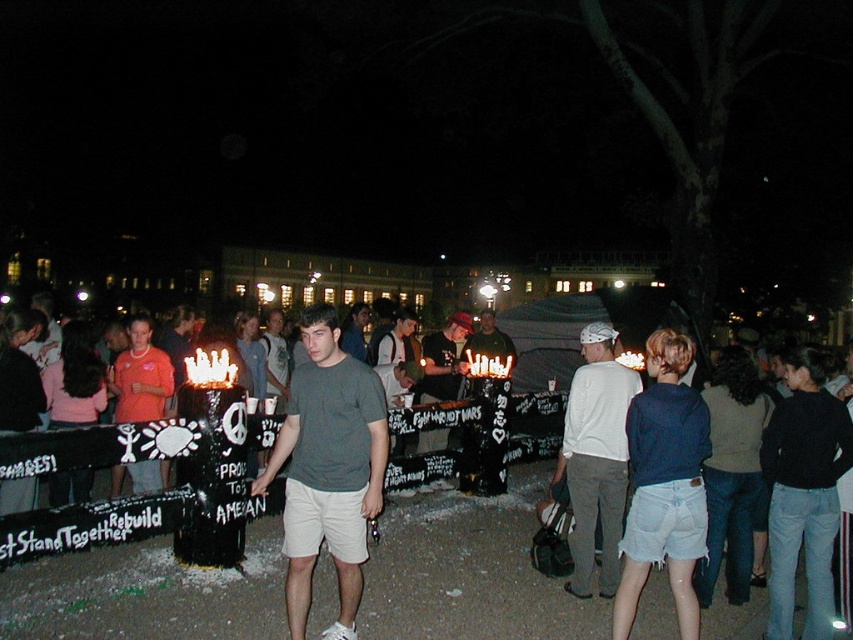
Based on the photo, you are standing at the origin point in the image and want to find the white matte shirt at center. In which direction should you look to locate it?

The white matte shirt at center is located at coordinates approximately 0.716 on the x axis and 0.700 on the y axis, so you should look towards the upper right direction from your current position.